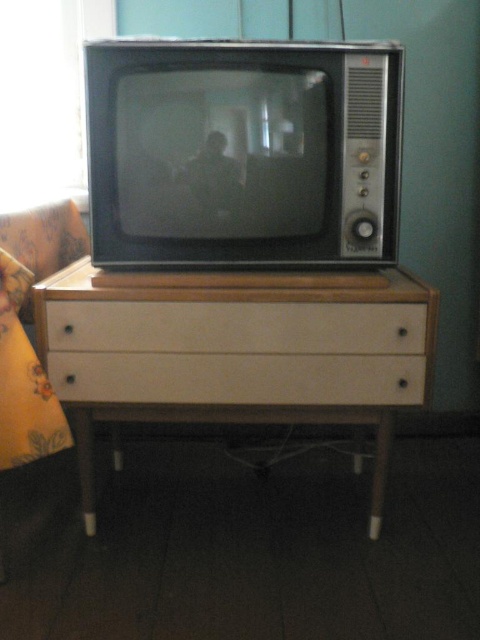
Question: Which point is closer to the camera taking this photo?

Choices:
 (A) pyautogui.click(x=370, y=330)
 (B) pyautogui.click(x=355, y=374)
 (C) pyautogui.click(x=239, y=369)

Answer: (A)

Question: Does white wood table at center appear on the left side of white matte drawer at center?

Choices:
 (A) yes
 (B) no

Answer: (A)

Question: Which of these objects is positioned closest to the beige matte drawer at center?

Choices:
 (A) white wood table at center
 (B) white matte drawer at center

Answer: (A)

Question: Among these objects, which one is farthest from the camera?

Choices:
 (A) white wood table at center
 (B) beige matte drawer at center

Answer: (B)

Question: Is beige matte drawer at center below white matte drawer at center?

Choices:
 (A) no
 (B) yes

Answer: (A)

Question: Is white wood table at center below white matte drawer at center?

Choices:
 (A) no
 (B) yes

Answer: (B)